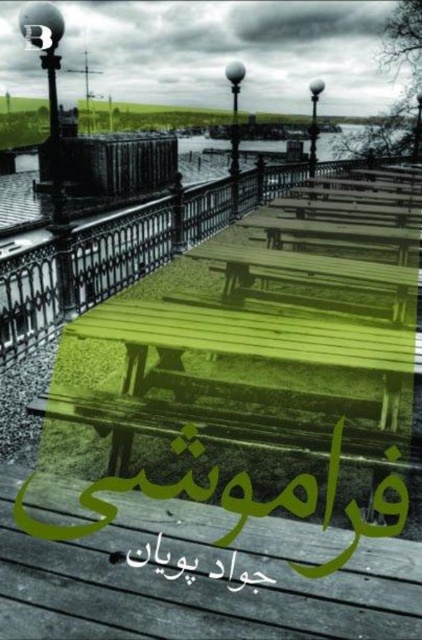
Question: Can you confirm if black paper at center is smaller than metallic lamp post at upper center?

Choices:
 (A) yes
 (B) no

Answer: (A)

Question: Is green painted wood rail at center bigger than polished metal lamp post at upper left?

Choices:
 (A) no
 (B) yes

Answer: (A)

Question: Is polished metal lamp post at upper left thinner than polished metal lamp post at upper center?

Choices:
 (A) no
 (B) yes

Answer: (A)

Question: Among these points, which one is nearest to the camera?

Choices:
 (A) (418, 96)
 (B) (235, 218)
 (C) (134, 564)

Answer: (C)

Question: Which is nearer to the polished metal lamp post at upper left?

Choices:
 (A) polished metal lamp post at upper center
 (B) green matte picnic table at center

Answer: (B)

Question: Which point is farther to the camera?

Choices:
 (A) green matte picnic table at center
 (B) green painted wood rail at center
 (C) black paper at center

Answer: (B)